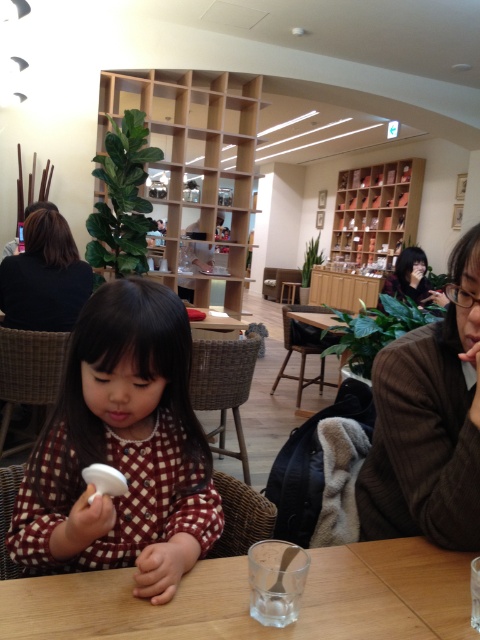
You are standing at the entrance of the space and want to go to the wooden table at center. Which direction should you walk to reach it?

The wooden table at center is located at the center of the space, so you should walk straight ahead from the entrance to reach it.

You are an interior designer analyzing the layout of this space. The dark brown hair at upper left is part of a decorative element. Where exactly is this decorative element located in the room?

The dark brown hair at upper left is located at point (45, 276) in the room.